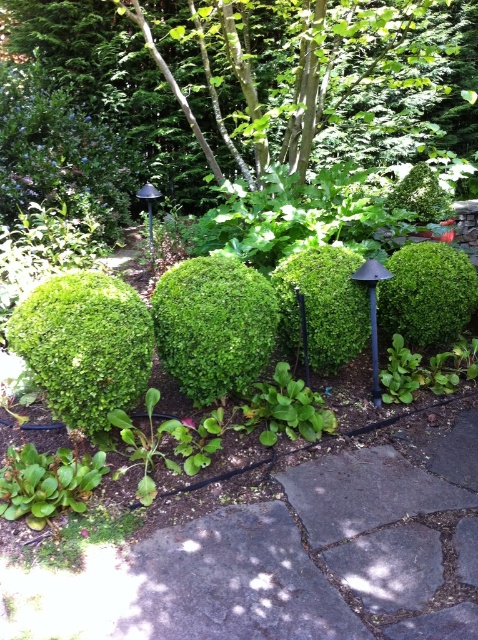
You are standing at the entrance of the garden and want to reach the green mossy bush at center. Which direction should you walk to reach it?

The green mossy bush at center is located at coordinate point (323, 305), so you should walk towards the center of the garden to reach it.

In the garden scene, you see a green fuzzy bush at left and a green matte shrub at center. Which one is smaller in size?

The green fuzzy bush at left is smaller compared to the green matte shrub at center.

You are standing on the stone pathway in the garden and want to place a small statue between the green mossy bush at center and the green leafy shrub at center. Based on their positions, where should the statue be placed to be between them?

The green mossy bush at center is below the green leafy shrub at center, so the statue should be placed between them along the vertical axis, below the green leafy shrub at center and above the green mossy bush at center.